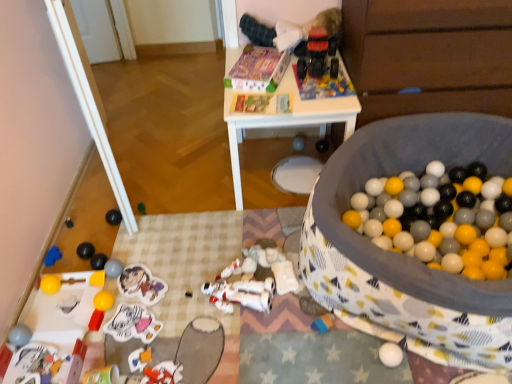
This screenshot has height=384, width=512. In order to click on vacant space behind white fabric doll at center, placed as the fifth toy when sorted from right to left in this screenshot , I will do `click(272, 249)`.